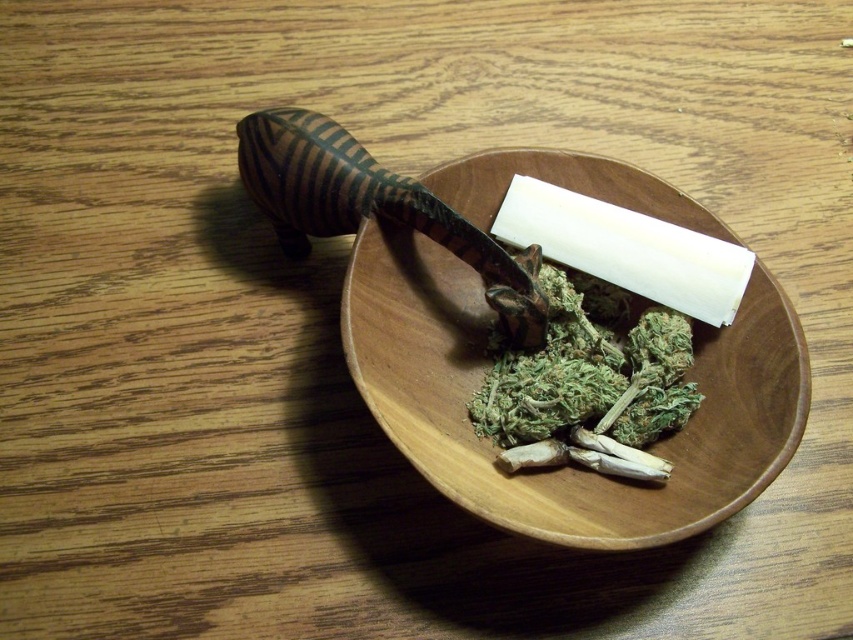
Question: Among these points, which one is farthest from the camera?

Choices:
 (A) (753, 355)
 (B) (682, 339)

Answer: (B)

Question: Is wooden bowl at center to the right of green leafy material at center from the viewer's perspective?

Choices:
 (A) yes
 (B) no

Answer: (B)

Question: Which point appears farthest from the camera in this image?

Choices:
 (A) (619, 456)
 (B) (721, 349)

Answer: (B)

Question: Can you confirm if wooden bowl at center is smaller than green leafy material at center?

Choices:
 (A) no
 (B) yes

Answer: (A)

Question: Is wooden bowl at center positioned before green leafy material at center?

Choices:
 (A) no
 (B) yes

Answer: (B)